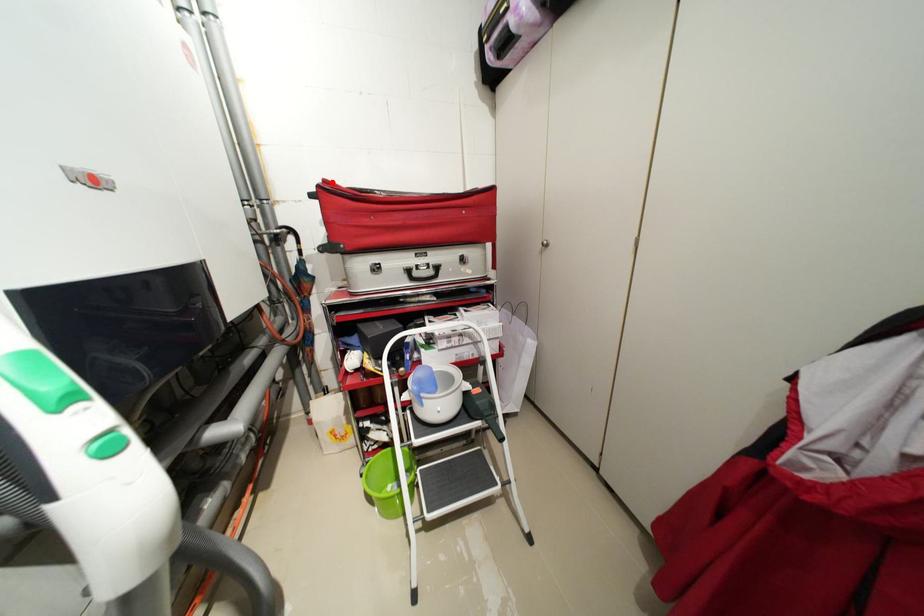
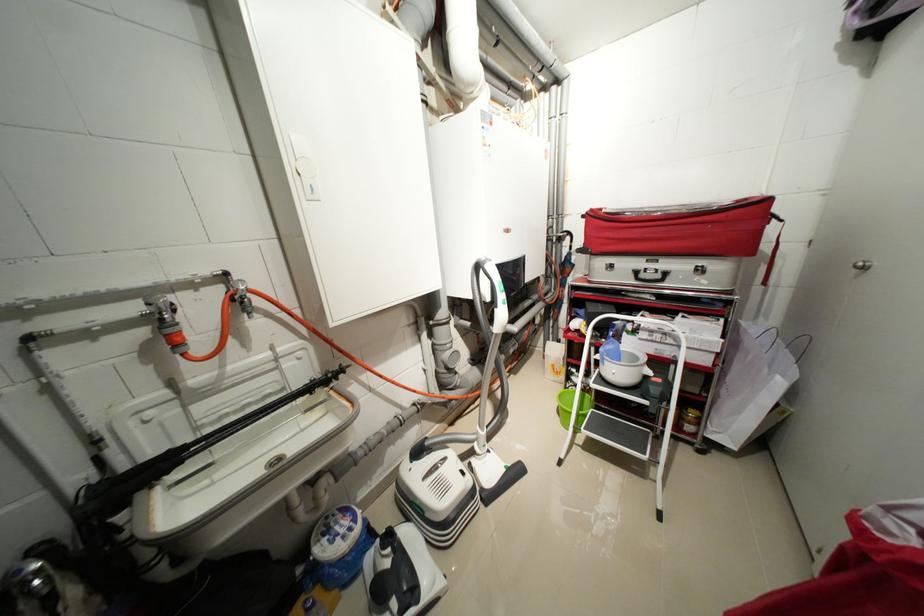
The point at the highlighted location is marked in the first image. Where is the corresponding point in the second image?

(599, 211)